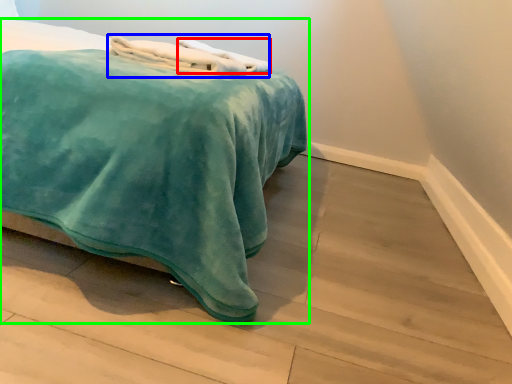
Question: Estimate the real-world distances between objects in this image. Which object is closer to bath towel (highlighted by a red box), bath towel (highlighted by a blue box) or bed (highlighted by a green box)?

Choices:
 (A) bath towel
 (B) bed

Answer: (A)